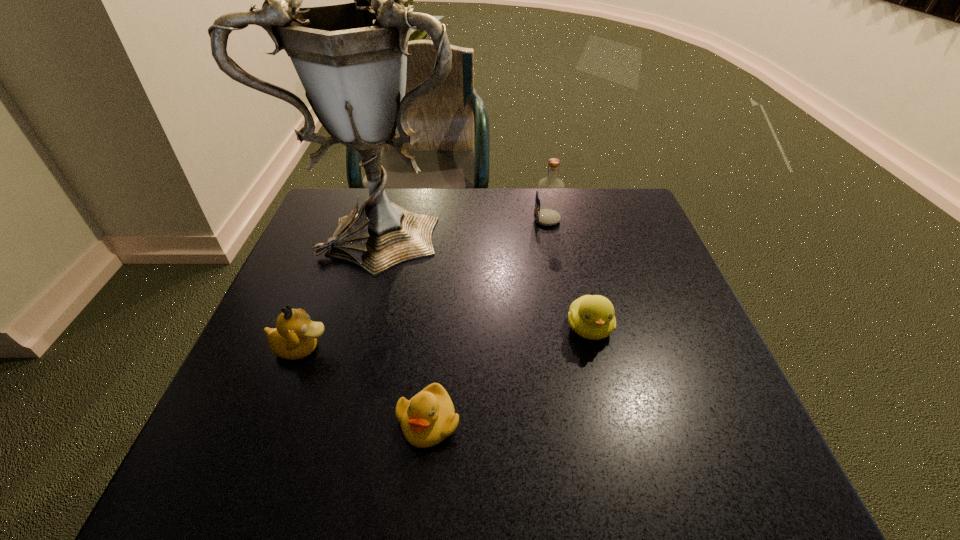
Locate an element on the screen. vacant point that satisfies the following two spatial constraints: 1. on the label of the vodka; 2. at the face of the nearest duckling is located at coordinates (587, 421).